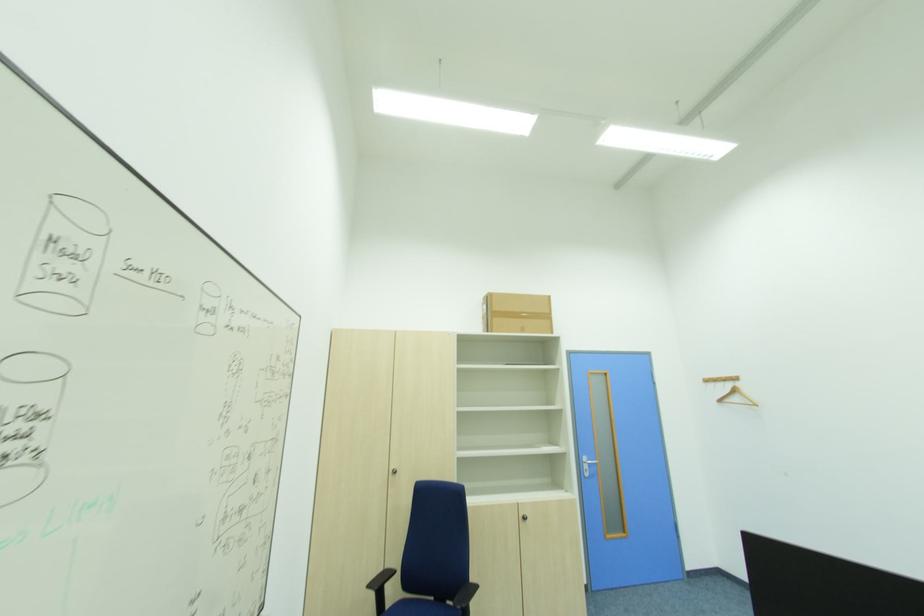
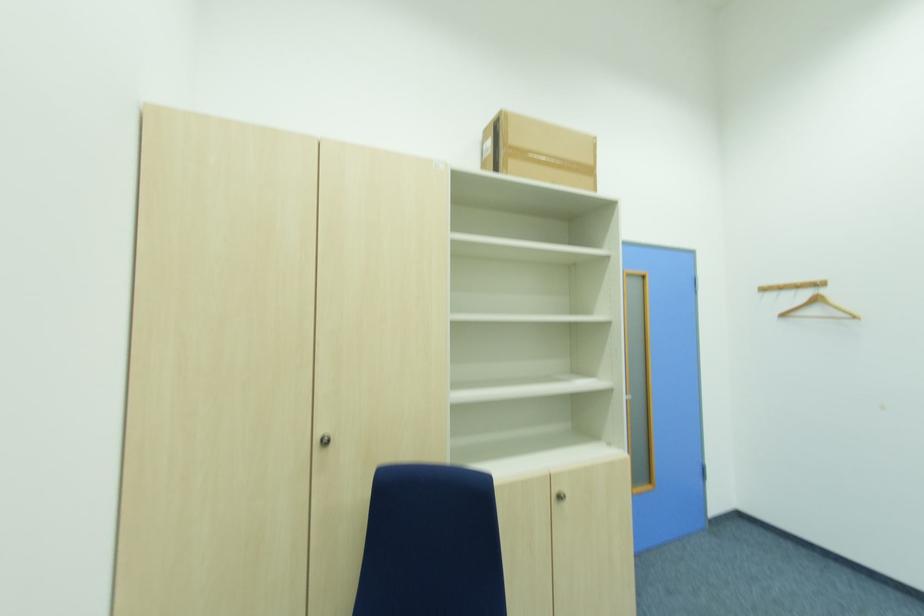
The point at (529,520) is marked in the first image. Where is the corresponding point in the second image?

(564, 499)